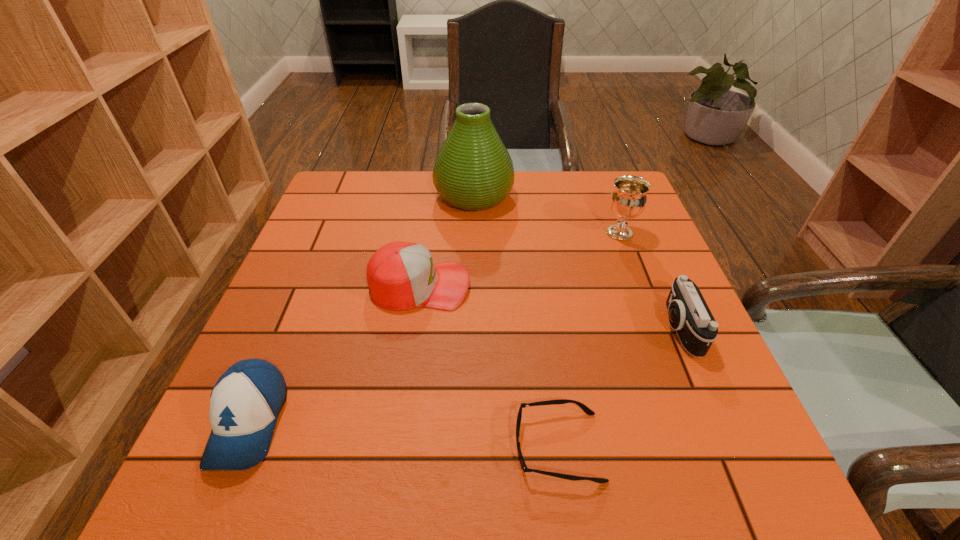
Image resolution: width=960 pixels, height=540 pixels. Identify the location of empty space that is in between the spectacles and the chalice. (588, 340).

Locate an element on the screen. The width and height of the screenshot is (960, 540). vacant space that is in between the camera and the leftmost object is located at coordinates (465, 376).

Find the location of a particular element. The height and width of the screenshot is (540, 960). empty space that is in between the right baseball cap and the farthest object is located at coordinates (446, 240).

This screenshot has width=960, height=540. Find the location of `vacant area that lies between the left baseball cap and the spectacles`. vacant area that lies between the left baseball cap and the spectacles is located at coordinates (403, 435).

Locate an element on the screen. The width and height of the screenshot is (960, 540). free space between the nearer baseball cap and the farther baseball cap is located at coordinates (334, 354).

Where is `empty space between the leftmost object and the camera`? This screenshot has height=540, width=960. empty space between the leftmost object and the camera is located at coordinates (465, 376).

At what (x,y) coordinates should I click in order to perform the action: click on free space between the farther baseball cap and the shortest object. Please return your answer as a coordinate pair (x, y). This screenshot has height=540, width=960. Looking at the image, I should click on (489, 366).

Where is `vacant region between the tallest object and the shortest object`? vacant region between the tallest object and the shortest object is located at coordinates (516, 321).

At what (x,y) coordinates should I click in order to perform the action: click on vacant region between the spectacles and the vase. Please return your answer as a coordinate pair (x, y). Image resolution: width=960 pixels, height=540 pixels. Looking at the image, I should click on (516, 321).

Locate an element on the screen. The width and height of the screenshot is (960, 540). free spot between the spectacles and the tallest object is located at coordinates (516, 321).